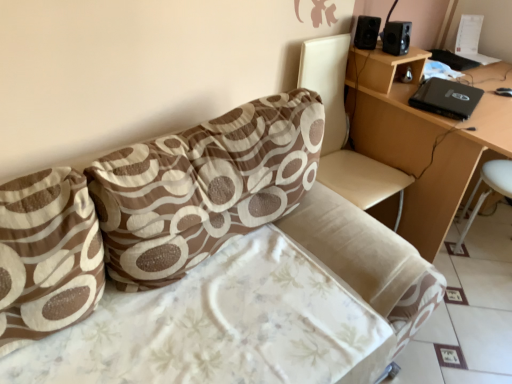
Question: Is black plastic speaker at upper right, which is the 1th speaker in right-to-left order, situated inside white plastic bar stool at lower right or outside?

Choices:
 (A) inside
 (B) outside

Answer: (B)

Question: From the image's perspective, is black plastic speaker at upper right, which is the 1th speaker in right-to-left order, above or below white plastic bar stool at lower right?

Choices:
 (A) below
 (B) above

Answer: (B)

Question: Which object is the closest to the beige leather swivel chair at upper right?

Choices:
 (A) brown printed fabric pillow at left, positioned as the second pillow in right-to-left order
 (B) light brown wooden table at upper right
 (C) black matte laptop at upper right
 (D) black matte speaker at upper right, which is the first speaker from left to right
 (E) brown printed fabric pillow at upper center, placed as the 2th pillow when sorted from left to right

Answer: (B)

Question: Considering the real-world distances, which object is closest to the brown printed fabric pillow at left, the 1th pillow positioned from the left?

Choices:
 (A) white plastic bar stool at lower right
 (B) black matte speaker at upper right, which is the 2th speaker in right-to-left order
 (C) black matte laptop at upper right
 (D) black plastic speaker at upper right, which is the 1th speaker in right-to-left order
 (E) light brown wooden table at upper right

Answer: (E)